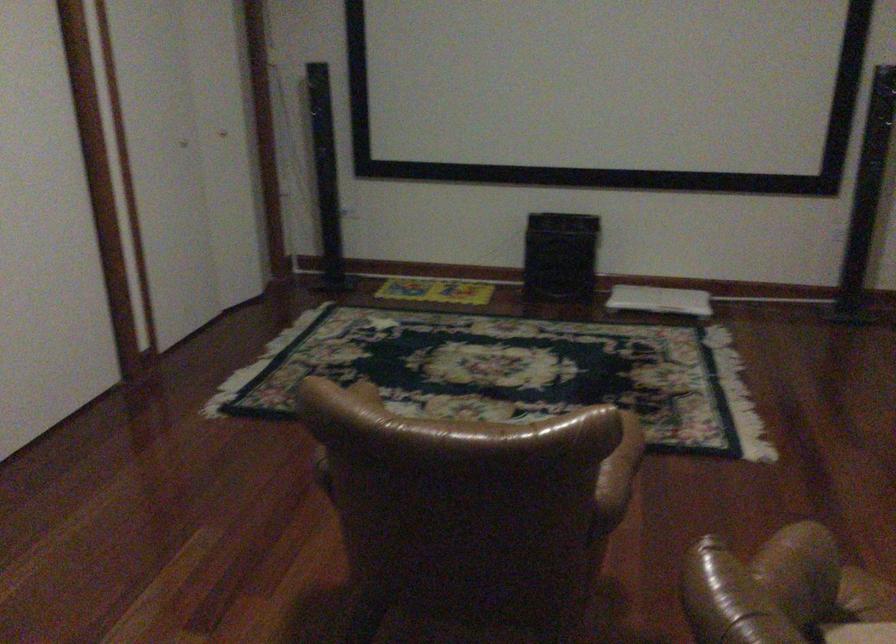
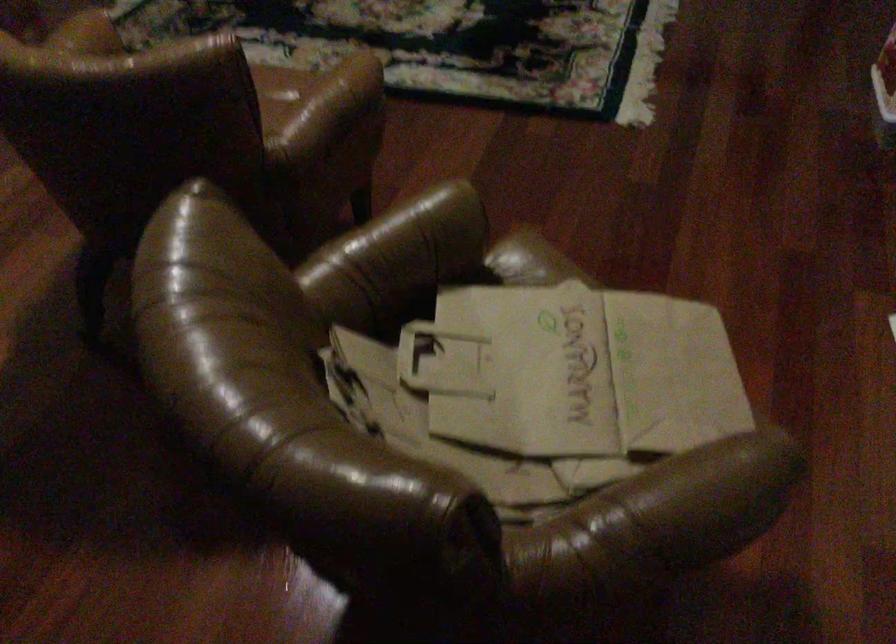
Question: In a continuous first-person perspective shot, in which direction is the camera moving?

Choices:
 (A) Left
 (B) Right
 (C) Forward
 (D) Backward

Answer: (B)